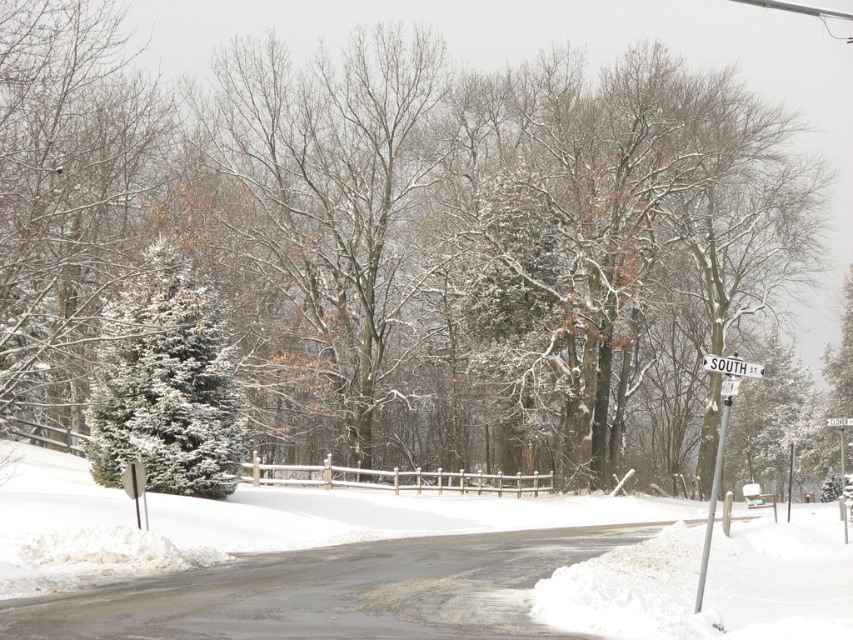
Question: Is silver metallic pole at right to the right of white plastic street sign at upper center from the viewer's perspective?

Choices:
 (A) no
 (B) yes

Answer: (B)

Question: Which is farther from the green matte evergreen tree at left?

Choices:
 (A) white plastic street sign at upper right
 (B) white plastic street sign at upper center
 (C) white fluffy snow at center
 (D) silver metallic pole at right

Answer: (A)

Question: Among these objects, which one is nearest to the camera?

Choices:
 (A) white plastic street sign at upper right
 (B) silver metallic pole at right

Answer: (B)

Question: Does white fluffy snow at center lie in front of white plastic street sign at upper center?

Choices:
 (A) no
 (B) yes

Answer: (B)

Question: Estimate the real-world distances between objects in this image. Which object is closer to the white plastic street sign at upper center?

Choices:
 (A) silver metallic pole at right
 (B) green matte evergreen tree at left

Answer: (A)

Question: Is green matte evergreen tree at left behind white plastic street sign at upper right?

Choices:
 (A) yes
 (B) no

Answer: (A)